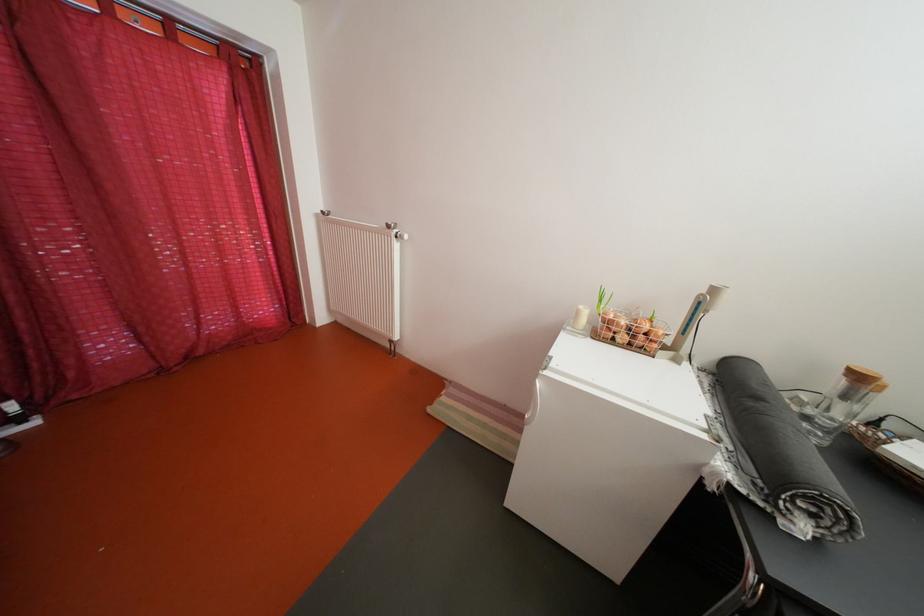
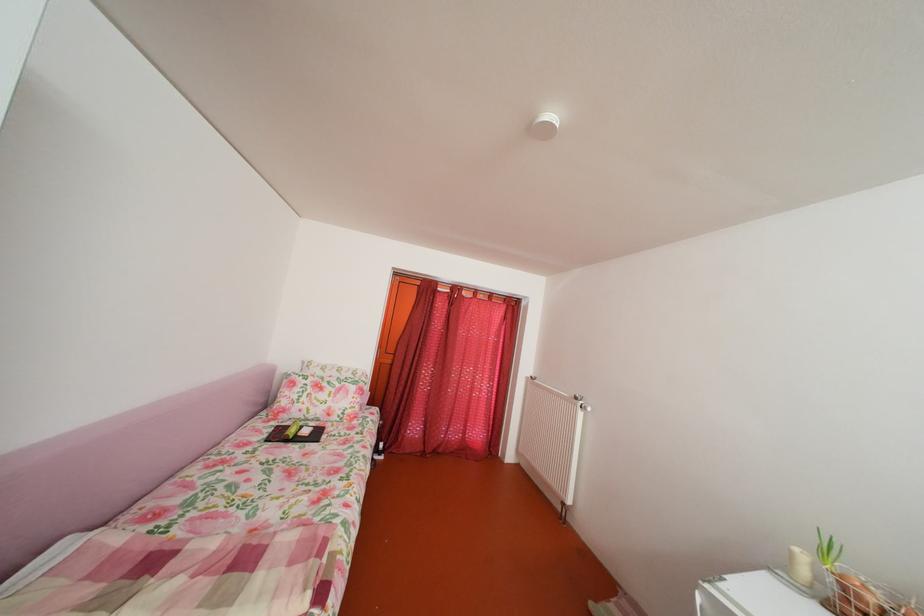
Locate, in the second image, the point that corresponds to [399,233] in the first image.

(588, 405)